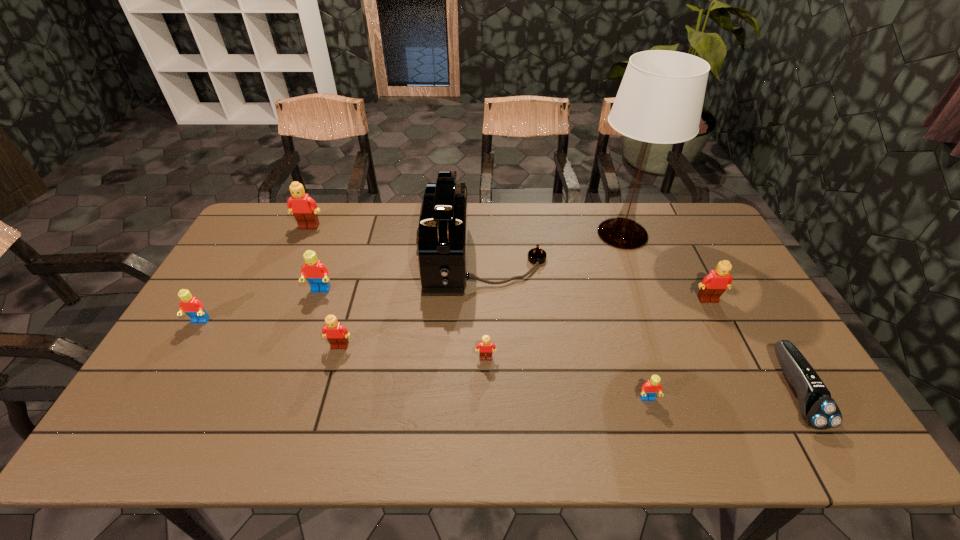
Identify the location of the tallest object. (660, 99).

Find the location of `radio receiver`. radio receiver is located at coordinates (442, 235).

What are the coordinates of `the biggest brown Lego` in the screenshot? It's located at (304, 208).

This screenshot has height=540, width=960. Find the location of `the ninth object from right to left`. the ninth object from right to left is located at coordinates tap(304, 208).

Locate an element on the screen. The height and width of the screenshot is (540, 960). the farthest red Lego is located at coordinates (316, 273).

Locate an element on the screen. This screenshot has width=960, height=540. the second red Lego from left to right is located at coordinates (316, 273).

Image resolution: width=960 pixels, height=540 pixels. I want to click on the rightmost Lego, so click(x=713, y=285).

Locate an element on the screen. The width and height of the screenshot is (960, 540). the ninth object from left to right is located at coordinates (713, 285).

In order to click on the leftmost object in this screenshot , I will do `click(190, 305)`.

The height and width of the screenshot is (540, 960). I want to click on the second nearest red Lego, so click(x=190, y=305).